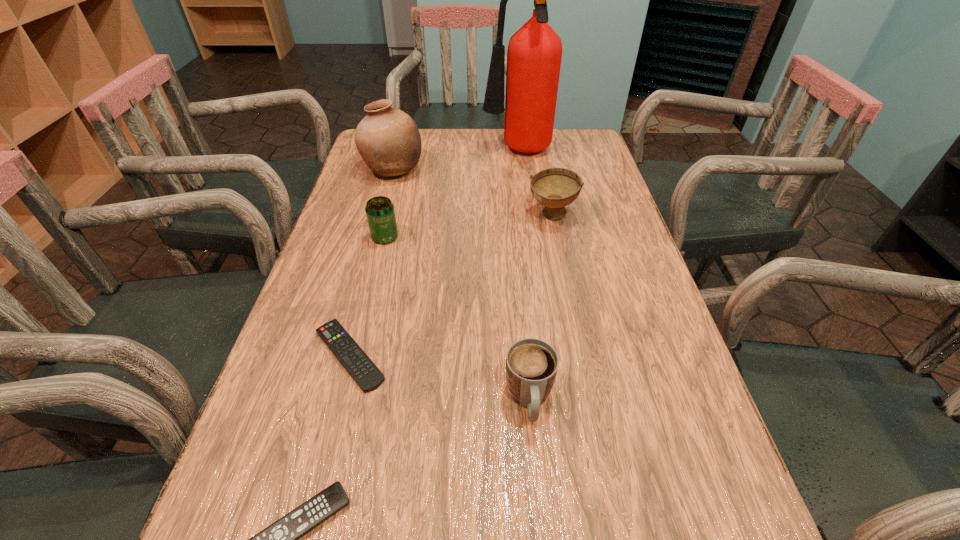
The height and width of the screenshot is (540, 960). What are the coordinates of `soup bowl present at the right edge` in the screenshot? It's located at (555, 188).

Locate an element on the screen. The image size is (960, 540). object present at the far left corner is located at coordinates (388, 140).

Identify the location of object present at the far right corner. This screenshot has height=540, width=960. (534, 53).

You are a GUI agent. You are given a task and a screenshot of the screen. Output one action in this format:
    pyautogui.click(x=<x>, y=<y>)
    Task: Click on the free space at the far edge of the desktop
    This screenshot has width=960, height=540.
    Given the screenshot: What is the action you would take?
    pyautogui.click(x=464, y=159)

Locate an element on the screen. This screenshot has height=540, width=960. free spot at the left edge of the desktop is located at coordinates (284, 470).

Locate an element on the screen. This screenshot has width=960, height=540. free space at the right edge is located at coordinates (576, 239).

At what (x,y) coordinates should I click in order to perform the action: click on vacant space at the far right corner of the desktop. Please return your answer as a coordinate pair (x, y). The image size is (960, 540). Looking at the image, I should click on (587, 161).

This screenshot has height=540, width=960. I want to click on unoccupied area between the soup bowl and the farther remote control, so click(450, 285).

This screenshot has height=540, width=960. What are the coordinates of `free space between the second tallest object and the mug` in the screenshot? It's located at (461, 285).

I want to click on free space between the farther remote control and the mug, so click(x=440, y=377).